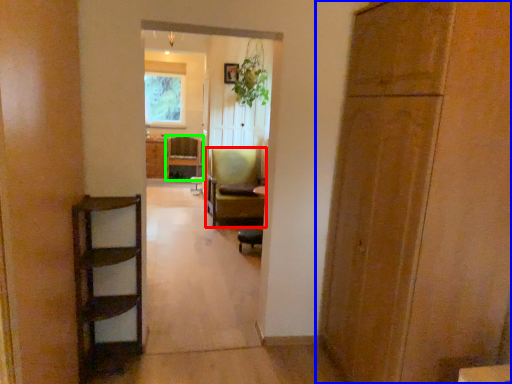
Question: Estimate the real-world distances between objects in this image. Which object is farther from chair (highlighted by a red box), door (highlighted by a blue box) or chair (highlighted by a green box)?

Choices:
 (A) door
 (B) chair

Answer: (A)